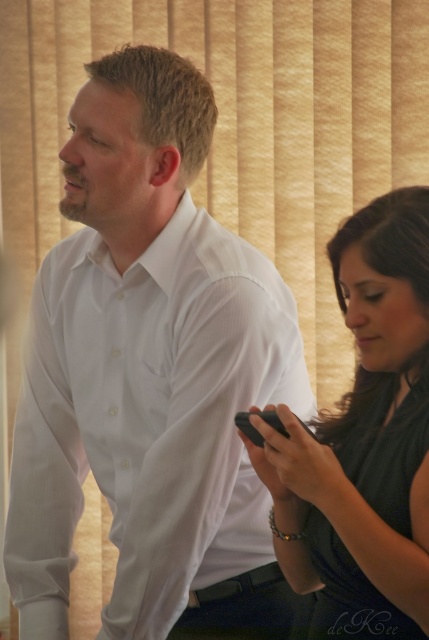
Between white smooth shirt at center and black matte phone at right, which one appears on the left side from the viewer's perspective?

white smooth shirt at center is more to the left.

Is white smooth shirt at center below black matte phone at right?

Incorrect, white smooth shirt at center is not positioned below black matte phone at right.

I want to click on white smooth shirt at center, so click(x=148, y=372).

The width and height of the screenshot is (429, 640). In order to click on white smooth shirt at center in this screenshot , I will do `click(148, 372)`.